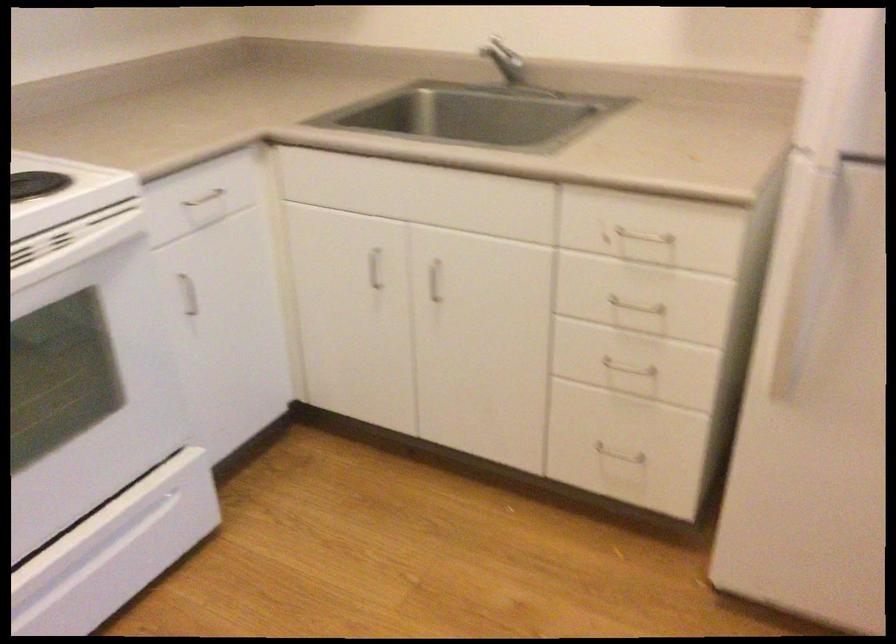
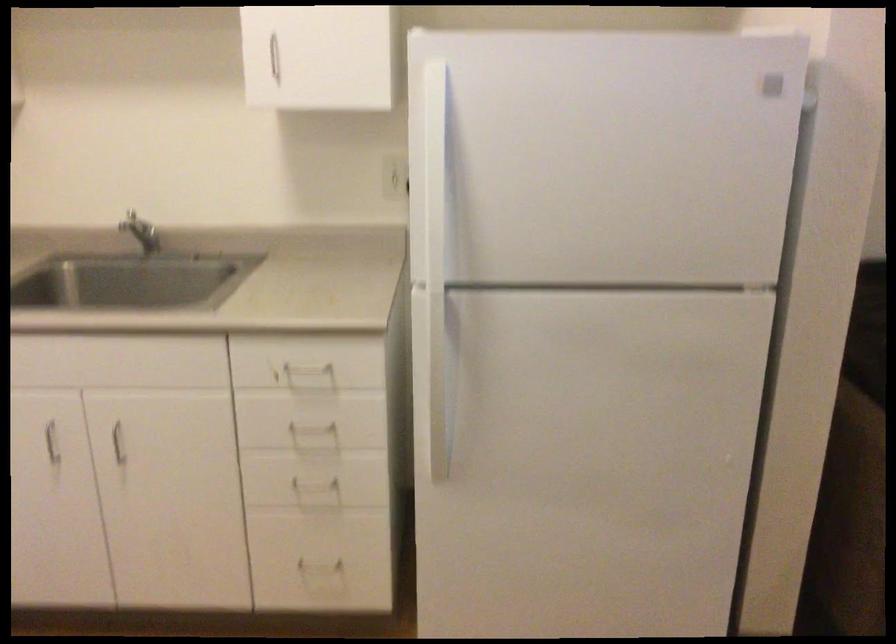
Where in the second image is the point corresponding to point 375,267 from the first image?

(52, 442)